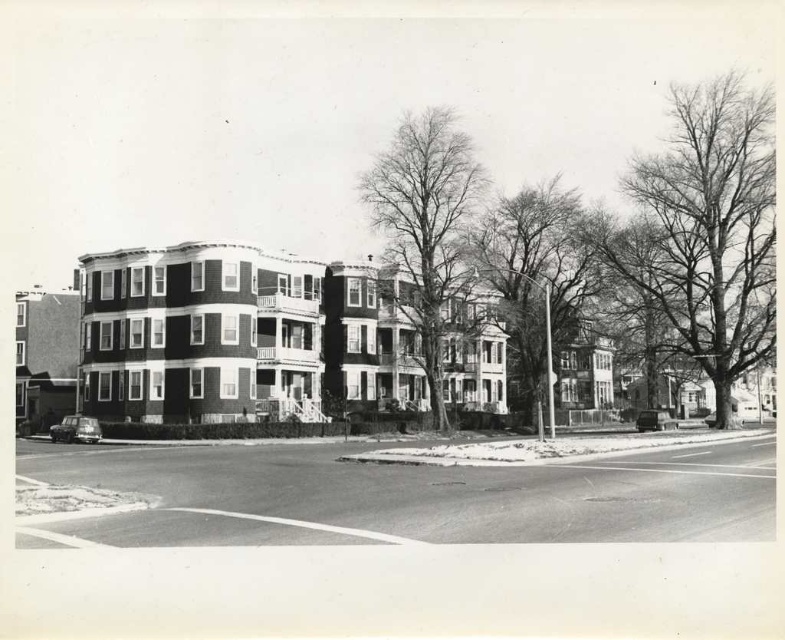
Is point (663, 256) positioned before point (513, 205)?

Yes, it is.

Is point (707, 314) more distant than point (585, 301)?

No.

Where is `bare branches at upper right`? The image size is (785, 640). bare branches at upper right is located at coordinates (706, 230).

Does bare branches at upper right have a lesser width compared to bare wood tree at center?

No.

Which is behind, point (749, 369) or point (378, 214)?

Positioned behind is point (749, 369).

Who is more distant from viewer, (772, 163) or (411, 288)?

Point (411, 288)

The height and width of the screenshot is (640, 785). I want to click on bare branches at upper right, so click(x=706, y=230).

Can you confirm if bare wood tree at center is positioned to the right of smooth bark tree at center?

Incorrect, bare wood tree at center is not on the right side of smooth bark tree at center.

Is point (404, 166) closer to camera compared to point (555, 224)?

Yes, point (404, 166) is in front of point (555, 224).

Between point (428, 259) and point (548, 410), which one is positioned behind?

Point (548, 410)

Locate an element on the screen. bare wood tree at center is located at coordinates (428, 237).